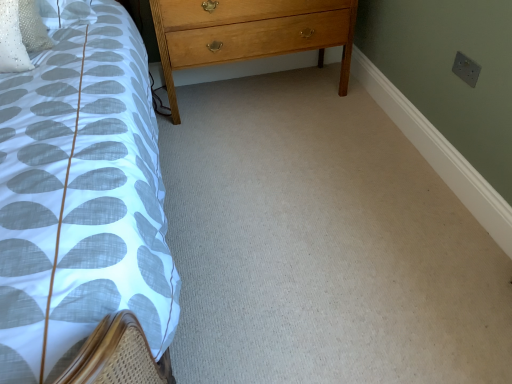
Identify the location of vacant space underneath light brown wood chest of drawers at center (from a real-world perspective). The height and width of the screenshot is (384, 512). (246, 91).